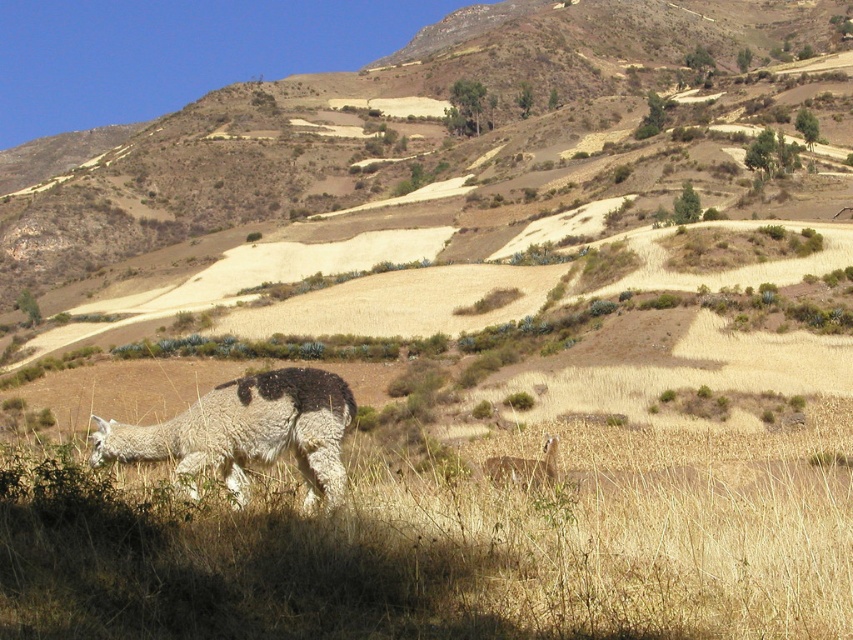
You are a photographer trying to capture both the fuzzy white alpaca at lower left and the fuzzy white alpaca at center in a single shot. Based on their positions, which alpaca will appear closer to the camera in the photo?

The fuzzy white alpaca at lower left will appear closer to the camera because it is positioned in front of the fuzzy white alpaca at center.

You are standing at the center of the terraced fields and see the fuzzy white alpaca at lower left. If you want to walk directly towards it, in which general direction should you move? Please answer with either north, south, east, or west.

Since the fuzzy white alpaca at lower left is located at point coordinates of 0.675 on the x axis and 0.291 on the y axis, you should move west to reach it.

You are standing at the point labeled as point (247, 432) in the image. What animal are you likely observing nearby?

The point (247, 432) corresponds to the fuzzy white alpaca at lower left, so you are likely observing the fuzzy white alpaca at lower left nearby.